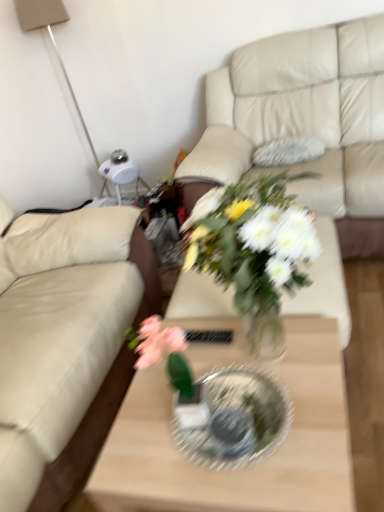
Where is `vacant space situated above clear glass plate at center (from a real-world perspective)`? This screenshot has width=384, height=512. vacant space situated above clear glass plate at center (from a real-world perspective) is located at coordinates (240, 404).